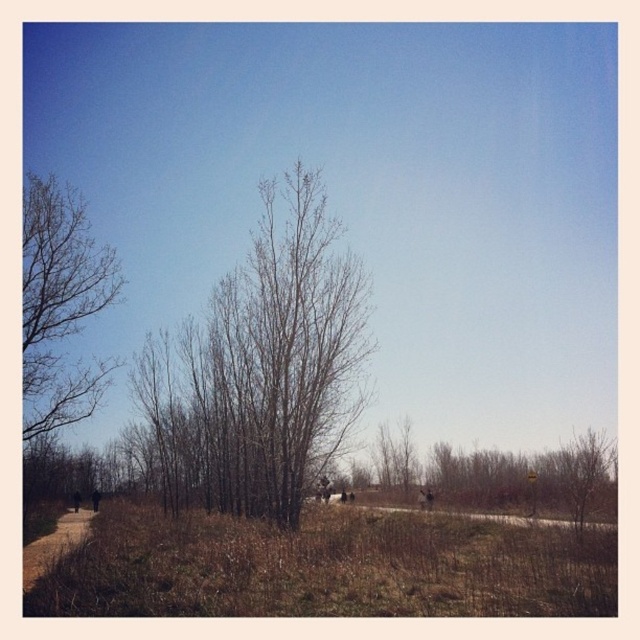
Question: Which of the following is the farthest from the observer?

Choices:
 (A) (266, 310)
 (B) (92, 502)
 (C) (74, 504)

Answer: (C)

Question: Does bare wood tree at center appear under dark clothing figure at lower left?

Choices:
 (A) no
 (B) yes

Answer: (A)

Question: Can you confirm if brown dirt path at lower left is positioned to the left of dark clothing figure at lower left?

Choices:
 (A) no
 (B) yes

Answer: (A)

Question: Among these objects, which one is nearest to the camera?

Choices:
 (A) dark clothing figure at lower left
 (B) bare branches at left
 (C) dark brown fur at center

Answer: (B)

Question: Among these points, which one is nearest to the camera?

Choices:
 (A) (65, 524)
 (B) (76, 490)

Answer: (A)

Question: Can you confirm if bare branches at left is positioned to the left of dark brown fur at center?

Choices:
 (A) yes
 (B) no

Answer: (B)